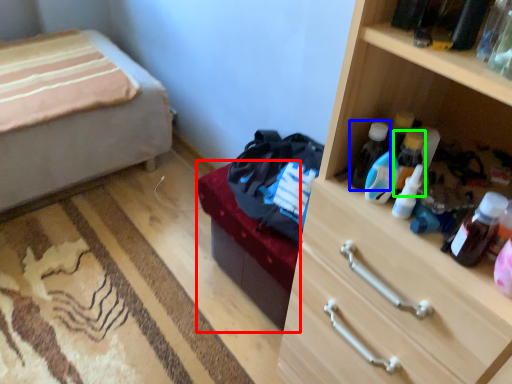
Question: Estimate the real-world distances between objects in this image. Which object is farther from bed frame (highlighted by a red box), bottle (highlighted by a blue box) or bottle (highlighted by a green box)?

Choices:
 (A) bottle
 (B) bottle

Answer: (B)